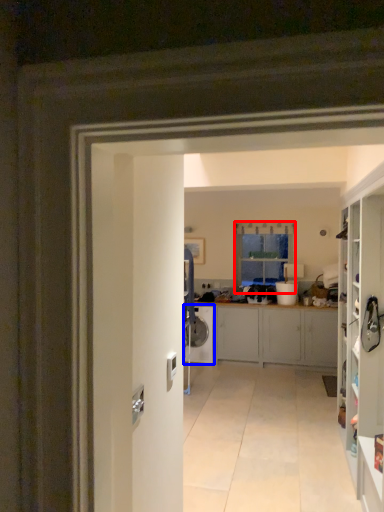
Question: Which object is further to the camera taking this photo, window (highlighted by a red box) or washing machine (highlighted by a blue box)?

Choices:
 (A) window
 (B) washing machine

Answer: (A)